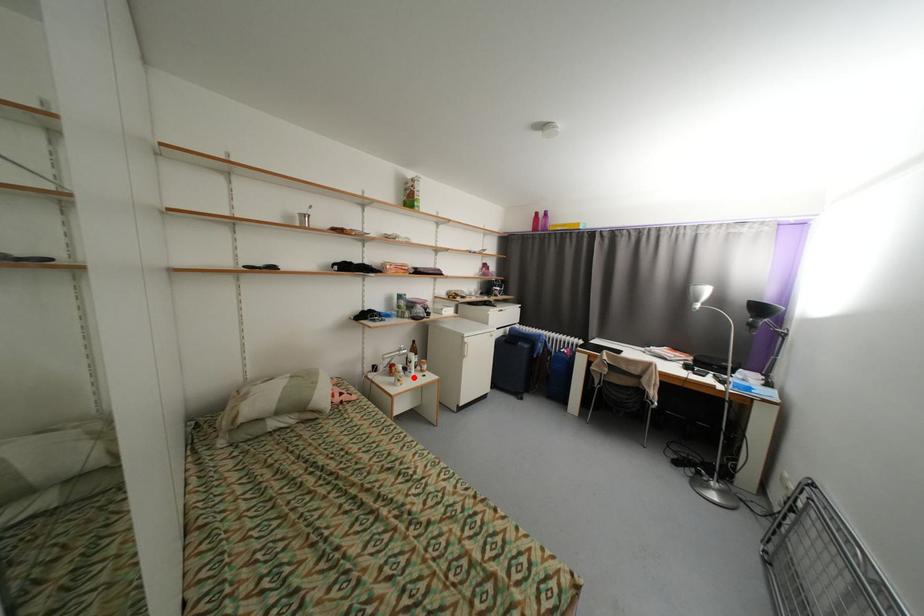
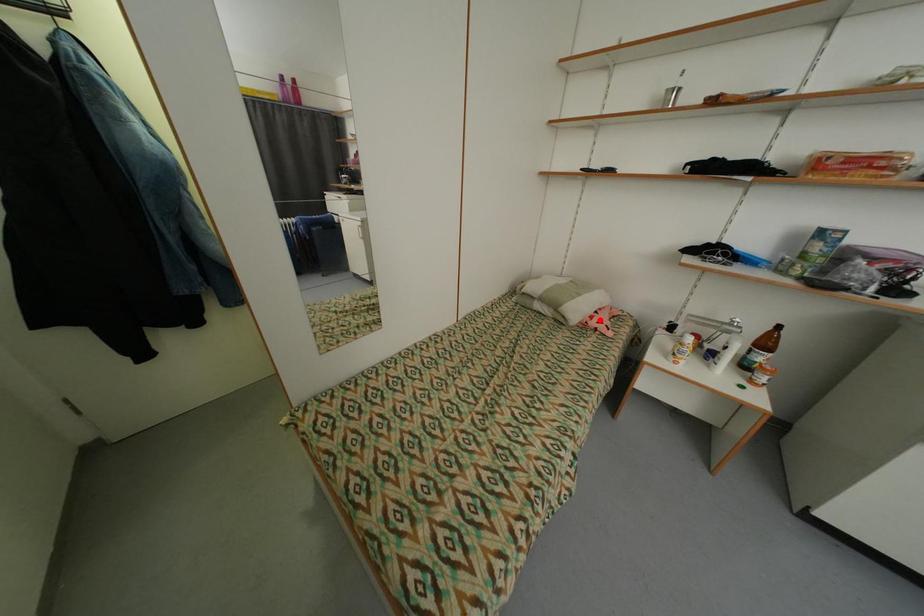
Looking at this image, I am providing you with two images of the same scene from different viewpoints. A red point is marked on the first image and another point is marked on the second image. Is the marked point in image1 the same physical position as the marked point in image2?

No